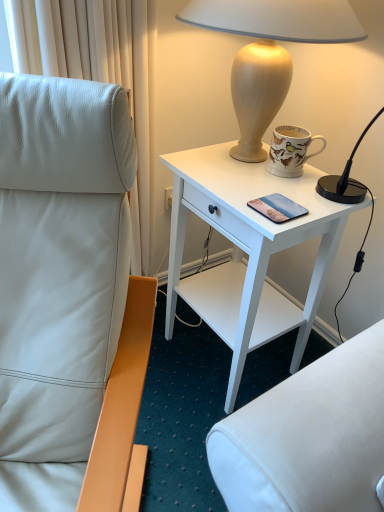
Describe the element at coordinates (290, 151) in the screenshot. The image size is (384, 512). I see `porcelain mug with bird illustrations at upper right` at that location.

The image size is (384, 512). What do you see at coordinates (247, 251) in the screenshot? I see `white wood desk at upper right` at bounding box center [247, 251].

Describe the element at coordinates (277, 208) in the screenshot. I see `matte glass mobile phone at center` at that location.

Where is `matte glass mobile phone at center`? Image resolution: width=384 pixels, height=512 pixels. matte glass mobile phone at center is located at coordinates (277, 208).

Find the location of a particular element. This screenshot has width=384, height=512. porcelain mug with bird illustrations at upper right is located at coordinates (290, 151).

Considering the relative sizes of porcelain mug with bird illustrations at upper right and white wood desk at upper right in the image provided, is porcelain mug with bird illustrations at upper right taller than white wood desk at upper right?

No, porcelain mug with bird illustrations at upper right is not taller than white wood desk at upper right.

I want to click on desk below the porcelain mug with bird illustrations at upper right (from a real-world perspective), so click(247, 251).

From a real-world perspective, who is located higher, porcelain mug with bird illustrations at upper right or white wood desk at upper right?

porcelain mug with bird illustrations at upper right, from a real-world perspective.

How distant is porcelain mug with bird illustrations at upper right from white wood desk at upper right?

porcelain mug with bird illustrations at upper right and white wood desk at upper right are 11.41 inches apart from each other.

How different are the orientations of white leather chair at left and white wood desk at upper right in degrees?

They differ by 47.5 degrees in their facing directions.

From a real-world perspective, is white leather chair at left physically located above or below white wood desk at upper right?

In terms of real-world spatial position, white leather chair at left is above white wood desk at upper right.

The height and width of the screenshot is (512, 384). In the image, there is a white leather chair at left. In order to click on desk below it (from a real-world perspective) in this screenshot , I will do `click(247, 251)`.

Is white wood desk at upper right surrounded by white leather chair at left?

No, white leather chair at left does not contain white wood desk at upper right.

Considering the positions of points (295, 206) and (239, 70), is point (295, 206) closer to camera compared to point (239, 70)?

Yes, it is in front of point (239, 70).

How much distance is there between matte glass mobile phone at center and wooden lamp at upper right?

A distance of 12.82 inches exists between matte glass mobile phone at center and wooden lamp at upper right.

Can you confirm if matte glass mobile phone at center is positioned to the left of wooden lamp at upper right?

No.

Find the location of `lamp positioned vertically above the matte glass mobile phone at center (from a real-world perspective)`. lamp positioned vertically above the matte glass mobile phone at center (from a real-world perspective) is located at coordinates (269, 52).

The width and height of the screenshot is (384, 512). In order to click on coffee cup above the matte glass mobile phone at center (from a real-world perspective) in this screenshot , I will do `click(290, 151)`.

Is matte glass mobile phone at center aimed at porcelain mug with bird illustrations at upper right?

No, matte glass mobile phone at center is not facing towards porcelain mug with bird illustrations at upper right.

In terms of height, does matte glass mobile phone at center look taller or shorter compared to porcelain mug with bird illustrations at upper right?

matte glass mobile phone at center is shorter than porcelain mug with bird illustrations at upper right.

Can you confirm if matte glass mobile phone at center is positioned to the right of porcelain mug with bird illustrations at upper right?

In fact, matte glass mobile phone at center is to the left of porcelain mug with bird illustrations at upper right.

Which of these two, white leather chair at left or wooden lamp at upper right, is smaller?

wooden lamp at upper right.

This screenshot has height=512, width=384. What are the coordinates of `lamp above the white leather chair at left (from the image's perspective)` in the screenshot? It's located at (269, 52).

Could wooden lamp at upper right be considered to be inside white leather chair at left?

No, wooden lamp at upper right is not surrounded by white leather chair at left.

How different are the orientations of white leather chair at left and wooden lamp at upper right in degrees?

The facing directions of white leather chair at left and wooden lamp at upper right are 45 degrees apart.

From the picture: Does wooden lamp at upper right appear on the left side of white leather chair at left?

In fact, wooden lamp at upper right is to the right of white leather chair at left.

Where is `chair that is below the wooden lamp at upper right (from the image's perspective)`? chair that is below the wooden lamp at upper right (from the image's perspective) is located at coordinates (69, 298).

Who is shorter, wooden lamp at upper right or white leather chair at left?

With less height is wooden lamp at upper right.

Is wooden lamp at upper right positioned behind white wood desk at upper right?

No, wooden lamp at upper right is closer to the camera.

Is wooden lamp at upper right surrounding white wood desk at upper right?

No.

In the scene shown: Between wooden lamp at upper right and white wood desk at upper right, which one appears on the right side from the viewer's perspective?

wooden lamp at upper right.

I want to click on coffee cup located behind the white wood desk at upper right, so click(290, 151).

What are the coordinates of `chair that is on the left side of white wood desk at upper right` in the screenshot? It's located at coord(69,298).

From the image, which object appears to be nearer to matte glass mobile phone at center, wooden lamp at upper right or white wood desk at upper right?

white wood desk at upper right is closer to matte glass mobile phone at center.

Estimate the real-world distances between objects in this image. Which object is closer to white wood desk at upper right, white leather chair at left or matte glass mobile phone at center?

The object closer to white wood desk at upper right is matte glass mobile phone at center.

When comparing their distances from wooden lamp at upper right, does white leather chair at left or matte glass mobile phone at center seem closer?

matte glass mobile phone at center is closer to wooden lamp at upper right.

Looking at this image, based on their spatial positions, is wooden lamp at upper right or matte glass mobile phone at center closer to porcelain mug with bird illustrations at upper right?

Based on the image, wooden lamp at upper right appears to be nearer to porcelain mug with bird illustrations at upper right.

Considering their positions, is porcelain mug with bird illustrations at upper right positioned closer to white leather chair at left than wooden lamp at upper right?

Among the two, wooden lamp at upper right is located nearer to white leather chair at left.

Looking at the image, which one is located further to wooden lamp at upper right, white wood desk at upper right or porcelain mug with bird illustrations at upper right?

white wood desk at upper right is positioned further to the anchor wooden lamp at upper right.

When comparing their distances from matte glass mobile phone at center, does wooden lamp at upper right or white leather chair at left seem further?

Among the two, white leather chair at left is located further to matte glass mobile phone at center.

In the scene shown: Based on their spatial positions, is white leather chair at left or porcelain mug with bird illustrations at upper right closer to matte glass mobile phone at center?

porcelain mug with bird illustrations at upper right is positioned closer to the anchor matte glass mobile phone at center.

Where is `lamp between white leather chair at left and white wood desk at upper right along the z-axis`? This screenshot has width=384, height=512. lamp between white leather chair at left and white wood desk at upper right along the z-axis is located at coordinates (269, 52).

You are a GUI agent. You are given a task and a screenshot of the screen. Output one action in this format:
    pyautogui.click(x=<x>, y=<y>)
    Task: Click on the desk between white leather chair at left and porcelain mug with bird illustrations at upper right in the front-back direction
    
    Given the screenshot: What is the action you would take?
    pyautogui.click(x=247, y=251)

What are the coordinates of `lamp between white leather chair at left and porcelain mug with bird illustrations at upper right in the front-back direction` in the screenshot? It's located at (269, 52).

The height and width of the screenshot is (512, 384). Find the location of `lamp between white leather chair at left and matte glass mobile phone at center in the front-back direction`. lamp between white leather chair at left and matte glass mobile phone at center in the front-back direction is located at coordinates (269, 52).